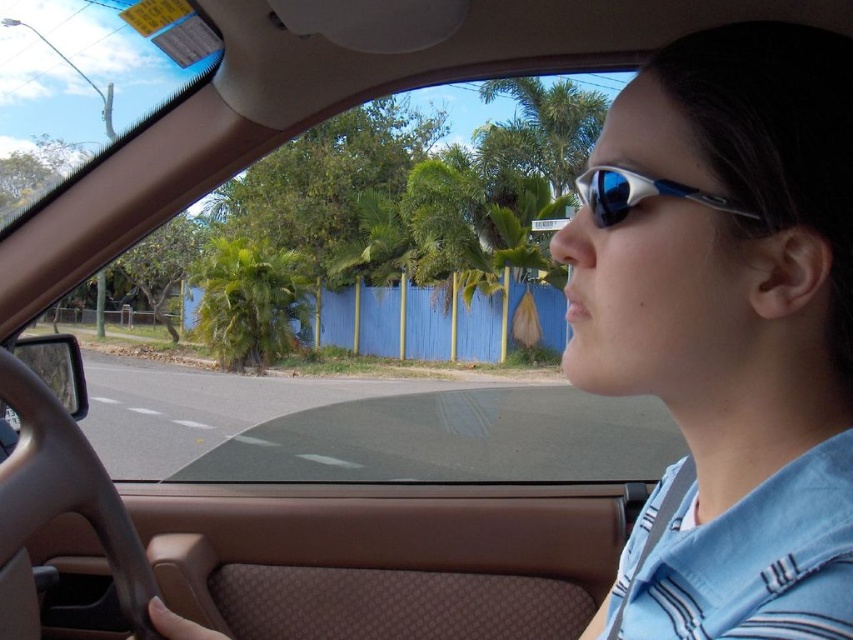
Measure the distance between point [699,346] and camera.

Point [699,346] is 23.33 inches away from camera.

Which of these two, blue reflective sunglasses at center or green leafy palm tree at center, stands taller?

green leafy palm tree at center

Is point (688, 289) farther from camera compared to point (227, 342)?

That is False.

Where is `blue reflective sunglasses at center`? This screenshot has height=640, width=853. blue reflective sunglasses at center is located at coordinates (727, 326).